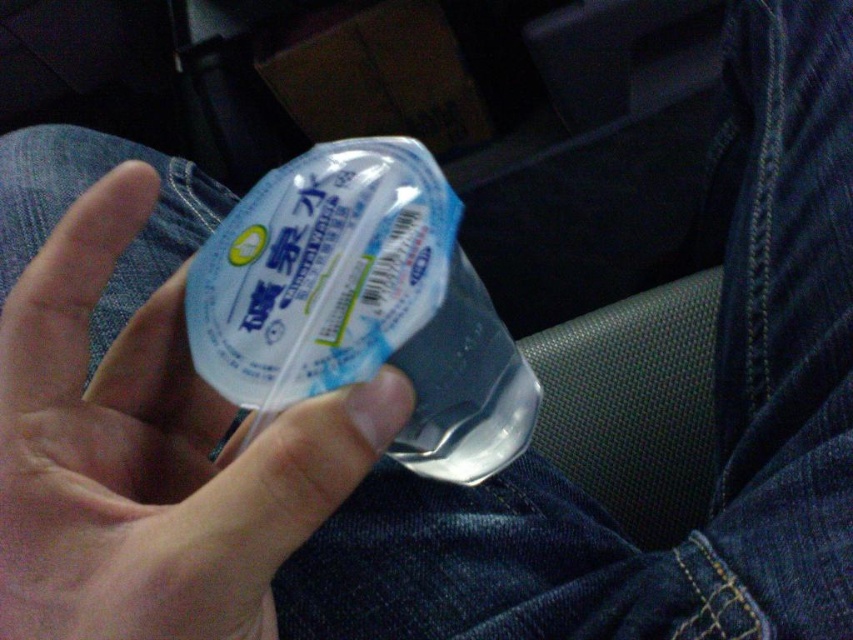
Is transparent plastic hand at center closer to the viewer compared to transparent plastic bottle at center?

Yes, transparent plastic hand at center is in front of transparent plastic bottle at center.

Which is behind, point (152, 452) or point (375, 230)?

Point (152, 452)

The height and width of the screenshot is (640, 853). Find the location of `transparent plastic hand at center`. transparent plastic hand at center is located at coordinates (149, 456).